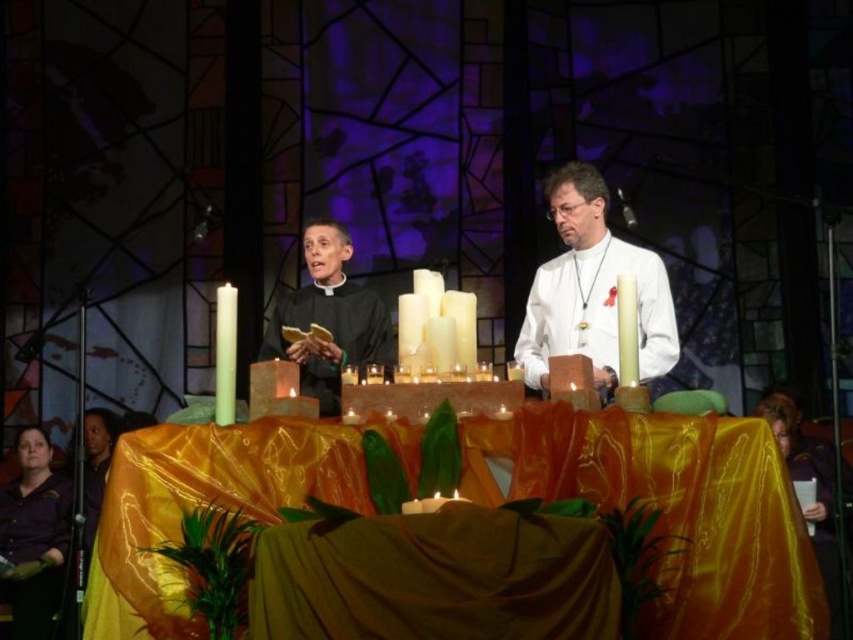
Question: Which of the following is the farthest from the observer?

Choices:
 (A) silky gold tablecloth at center
 (B) white glossy candle at left

Answer: (B)

Question: Can you confirm if silky gold tablecloth at center is thinner than purple satin robe at lower left?

Choices:
 (A) yes
 (B) no

Answer: (B)

Question: Estimate the real-world distances between objects in this image. Which object is closer to the purple satin robe at lower left?

Choices:
 (A) white glossy candle at left
 (B) silky gold tablecloth at center
 (C) matte black robe at center

Answer: (A)

Question: Does white glossy candle at left have a smaller size compared to white glossy candle at center?

Choices:
 (A) yes
 (B) no

Answer: (B)

Question: Can you confirm if white matte shirt at center is thinner than white glossy candle at center?

Choices:
 (A) yes
 (B) no

Answer: (B)

Question: Based on their relative distances, which object is nearer to the white glossy candle at center?

Choices:
 (A) matte black robe at center
 (B) white matte shirt at center
 (C) silky gold tablecloth at center
 (D) purple satin robe at lower left

Answer: (C)